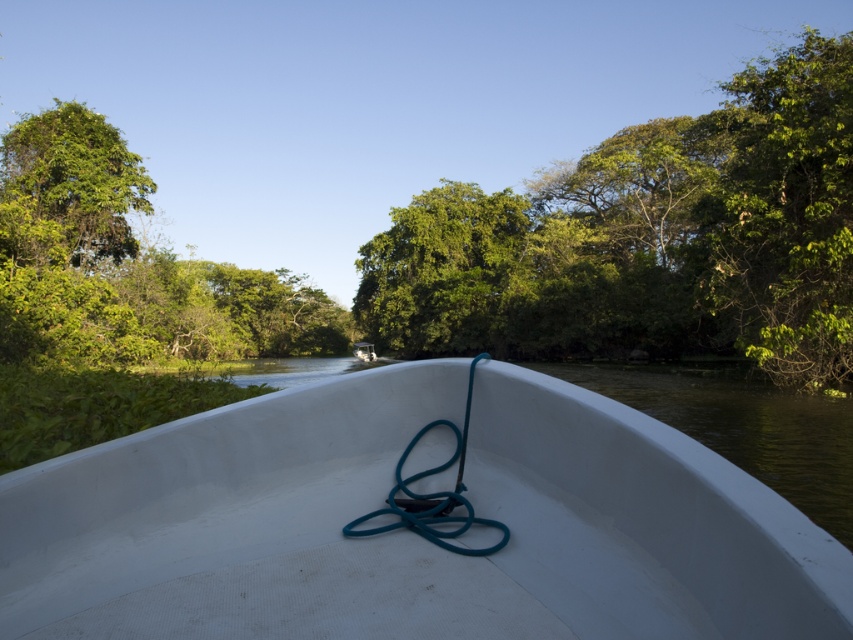
You are on a white boat at the bow. There is a point at (784, 211). What object is located at that point?

The point at (784, 211) corresponds to the green leafy tree at right.

You are a passenger on the white matte boat at center and want to know if the green leafy trees at center are blocking your view of the sky. Based on their positions, can you determine if the trees are above or below the boat?

The green leafy trees at center is positioned over white matte boat at center, so the trees are above the boat, blocking your view of the sky.

You are a photographer trying to capture both the green leafy tree at upper left and the white matte boat at center in a single frame. Based on their sizes in the image, which one should you focus on to ensure both fit in the photo?

The green leafy tree at upper left might be wider than white matte boat at center, so focusing on the tree would help ensure both fit in the photo since it occupies more space.